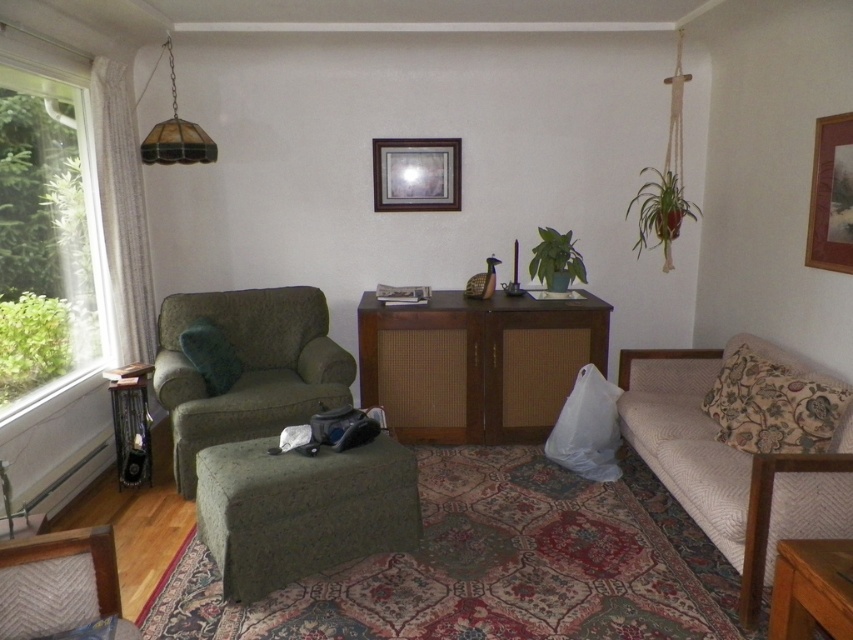
Which is more to the left, green fabric armchair at left or wooden framed artwork at upper right?

From the viewer's perspective, green fabric armchair at left appears more on the left side.

Between point (180, 470) and point (813, 168), which one is positioned in front?

Point (813, 168) is in front.

Which is in front, point (190, 435) or point (828, 214)?

Point (828, 214)

Identify the location of green fabric armchair at left. (248, 369).

Which is in front, point (525, 337) or point (247, 486)?

Point (247, 486) is more forward.

Between rattan wood cabinet at center and green fabric ottoman at center, which one is positioned higher?

Positioned higher is rattan wood cabinet at center.

In order to click on rattan wood cabinet at center in this screenshot , I will do `click(476, 364)`.

Who is lower down, green fabric ottoman at center or wooden picture frame at upper center?

Positioned lower is green fabric ottoman at center.

Where is `green fabric ottoman at center`? green fabric ottoman at center is located at coordinates (300, 509).